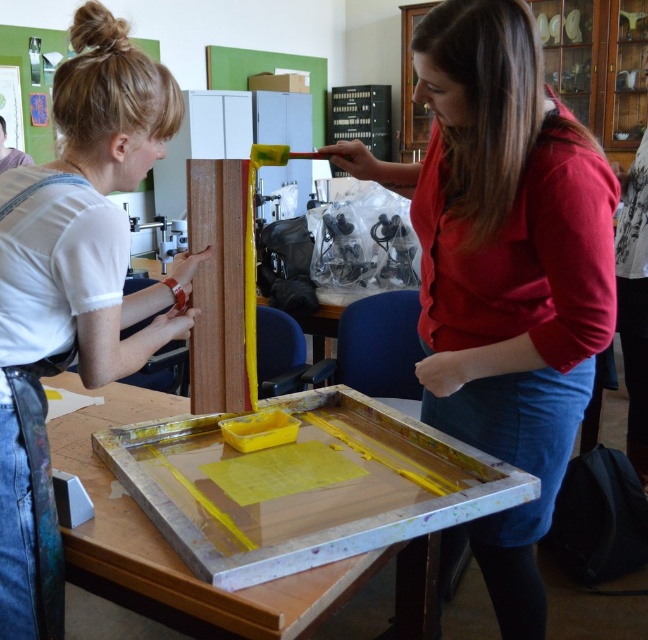
You are an observer standing in front of the scene. There is a matte red blouse at center and a wooden tray at center. Which object is positioned higher in the scene?

The matte red blouse at center is located above the wooden tray at center, so it is positioned higher in the scene.

Consider the image. You are organizing a craft fair and need to decide which item to display first. Based on the scene, which object is wider between the wooden tray at center and the wooden plank at center?

The wooden tray at center is wider than the wooden plank at center according to the description.